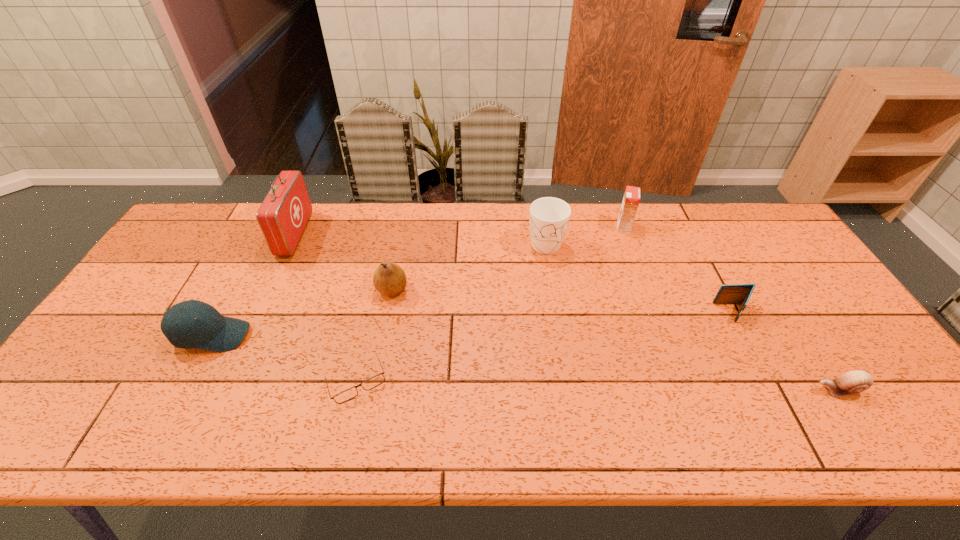
Find the location of a particular element. The width and height of the screenshot is (960, 540). the first-aid kit is located at coordinates (283, 215).

Where is `mug`? The image size is (960, 540). mug is located at coordinates (549, 217).

This screenshot has width=960, height=540. What are the coordinates of `orange juice` in the screenshot? It's located at (631, 199).

At what (x,y) coordinates should I click in order to perform the action: click on the fifth nearest object. Please return your answer as a coordinate pair (x, y). Looking at the image, I should click on (389, 279).

I want to click on baseball cap, so click(x=211, y=331).

At what (x,y) coordinates should I click in order to perform the action: click on wallet. Please return your answer as a coordinate pair (x, y). Looking at the image, I should click on (735, 293).

This screenshot has width=960, height=540. Identify the location of the rightmost object. (855, 381).

This screenshot has height=540, width=960. Find the location of `spectacles`. spectacles is located at coordinates (346, 395).

Where is `vacant space situated 0.130m on the side of the tallest object with the first aid cross symbol`? Image resolution: width=960 pixels, height=540 pixels. vacant space situated 0.130m on the side of the tallest object with the first aid cross symbol is located at coordinates (344, 234).

The height and width of the screenshot is (540, 960). I want to click on vacant position located on the side of the mug with the handle, so click(x=561, y=342).